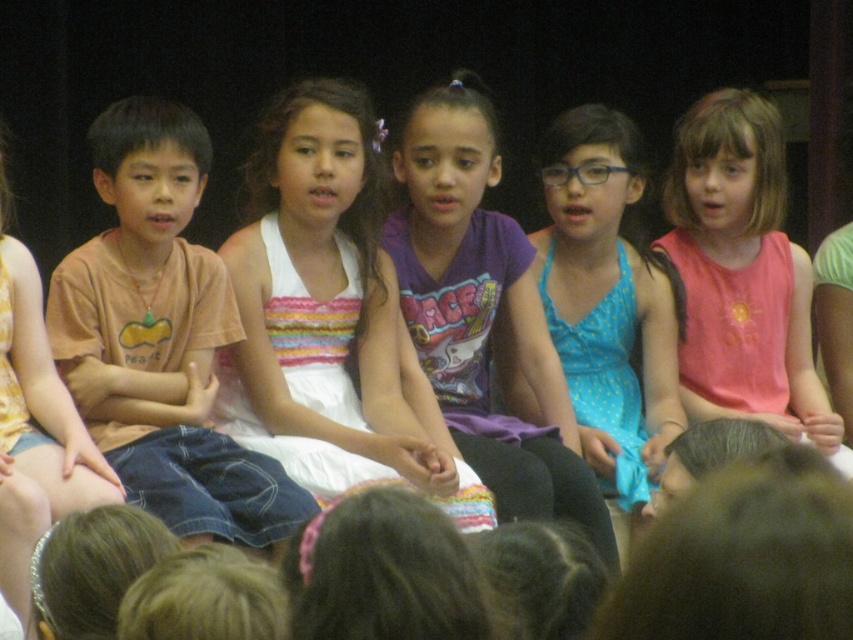
Is point (236, 296) positioned after point (199, 401)?

Yes.

Who is more distant from viewer, [401,444] or [207,394]?

Point [207,394]

Find the location of `white satin dress at center`. white satin dress at center is located at coordinates (326, 314).

At what (x,y) coordinates should I click in order to perform the action: click on white satin dress at center. Please return your answer as a coordinate pair (x, y). The image size is (853, 640). Looking at the image, I should click on tap(326, 314).